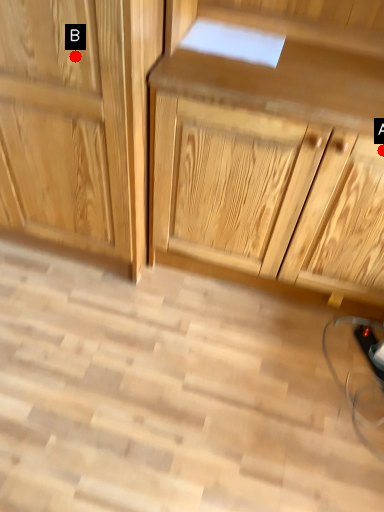
Question: Two points are circled on the image, labeled by A and B beside each circle. Which of the following is the closest to the observer?

Choices:
 (A) A is closer
 (B) B is closer

Answer: (B)